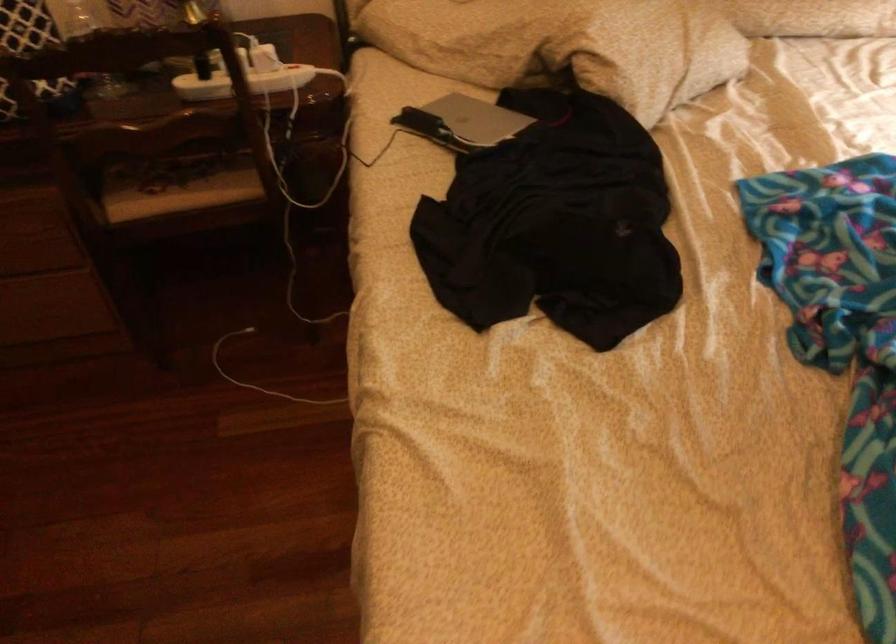
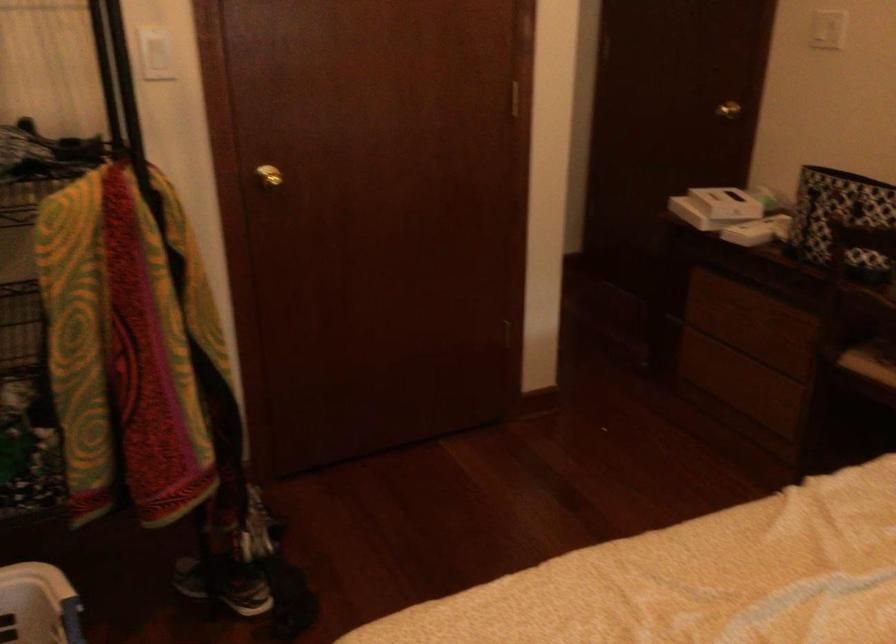
Question: The first image is from the beginning of the video and the second image is from the end. How did the camera likely rotate when shooting the video?

Choices:
 (A) Left
 (B) Right
 (C) Up
 (D) Down

Answer: (A)